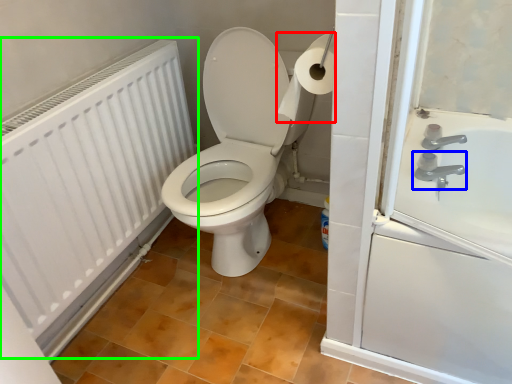
Question: Based on their relative distances, which object is farther from toilet paper (highlighted by a red box)? Choose from tap (highlighted by a blue box) and radiator (highlighted by a green box).

Choices:
 (A) tap
 (B) radiator

Answer: (B)